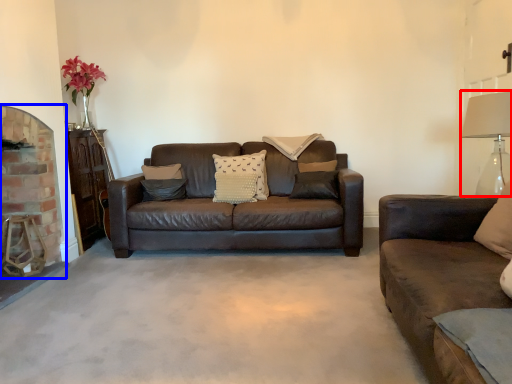
Question: Which object appears farthest to the camera in this image, table lamp (highlighted by a red box) or fireplace (highlighted by a blue box)?

Choices:
 (A) table lamp
 (B) fireplace

Answer: (B)